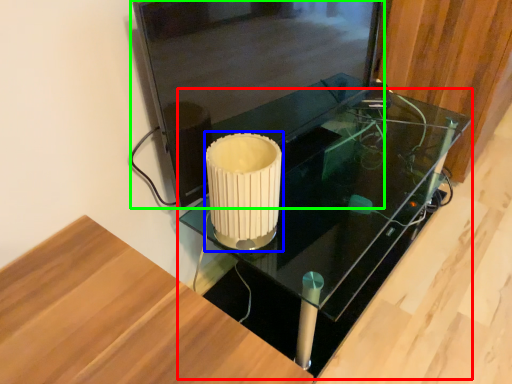
Question: Based on their relative distances, which object is nearer to table (highlighted by a red box)? Choose from candle holder (highlighted by a blue box) and glass door (highlighted by a green box).

Choices:
 (A) candle holder
 (B) glass door

Answer: (B)